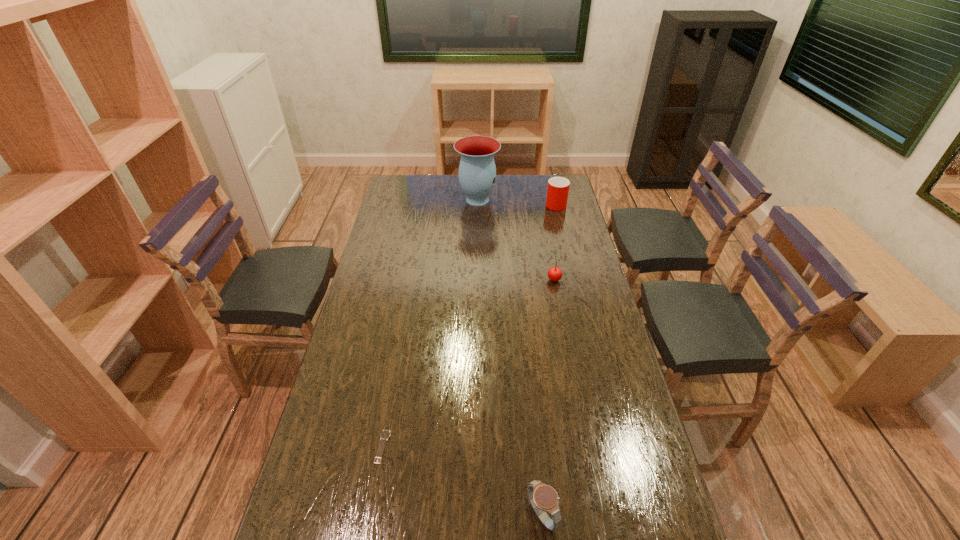
Locate an element on the screen. The image size is (960, 540). free spot located on the side of the cup with the handle is located at coordinates (549, 178).

Identify the location of vacant space located on the side of the cup with the handle. (551, 184).

Identify the location of vacant position located 0.200m on the left of the third nearest object. This screenshot has width=960, height=540. (493, 279).

This screenshot has height=540, width=960. Identify the location of free spot located on the back of the nearest object. (533, 422).

This screenshot has width=960, height=540. Find the location of `vacant space located 0.060m on the front of the fourth farthest object`. vacant space located 0.060m on the front of the fourth farthest object is located at coordinates (375, 488).

At what (x,y) coordinates should I click in order to perform the action: click on vase that is at the far edge. Please return your answer as a coordinate pair (x, y). This screenshot has width=960, height=540. Looking at the image, I should click on (477, 172).

The image size is (960, 540). Find the location of `cup located in the far edge section of the desktop`. cup located in the far edge section of the desktop is located at coordinates (558, 187).

Where is `cup at the right edge`? Image resolution: width=960 pixels, height=540 pixels. cup at the right edge is located at coordinates (558, 187).

This screenshot has height=540, width=960. Find the location of `cherry present at the right edge`. cherry present at the right edge is located at coordinates (554, 274).

You are a GUI agent. You are given a task and a screenshot of the screen. Output one action in this format:
    pyautogui.click(x=<x>, y=<y>)
    Task: Click on the object that is at the far right corner
    
    Given the screenshot: What is the action you would take?
    pyautogui.click(x=558, y=187)